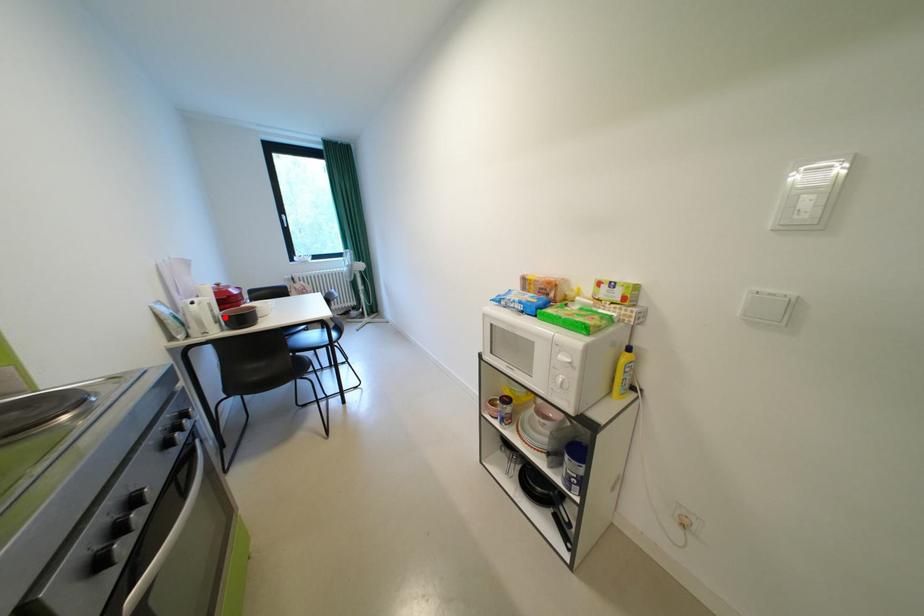
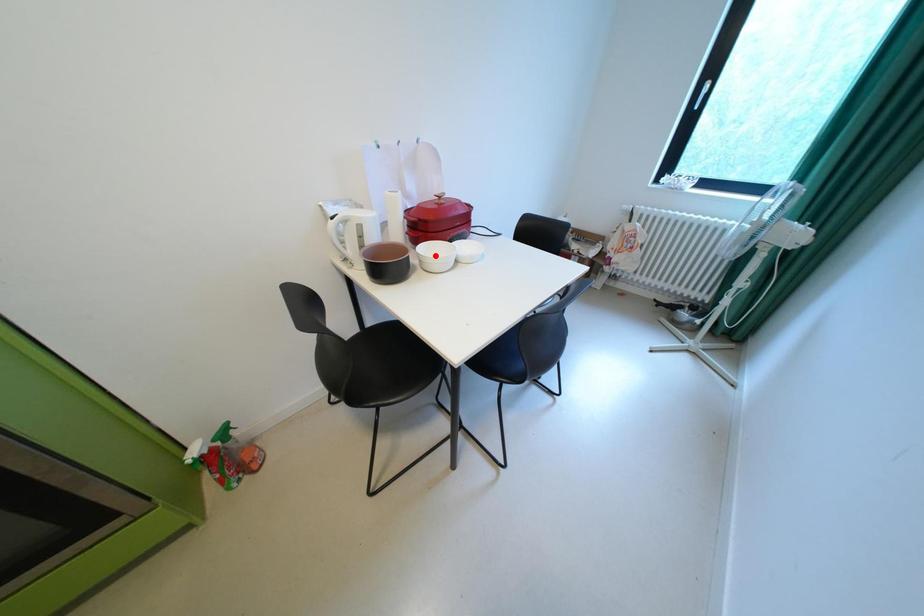
I am providing you with two images of the same scene from different viewpoints. A red point is marked on the first image and another point is marked on the second image. Is the red point in image1 aligned with the point shown in image2?

No